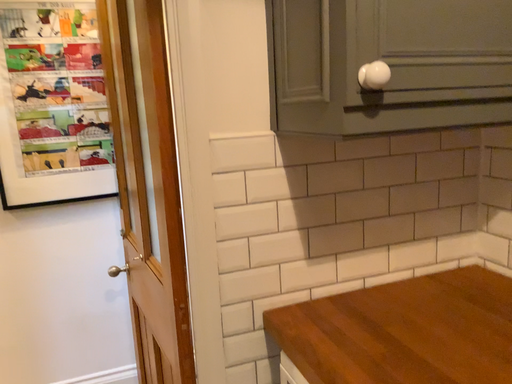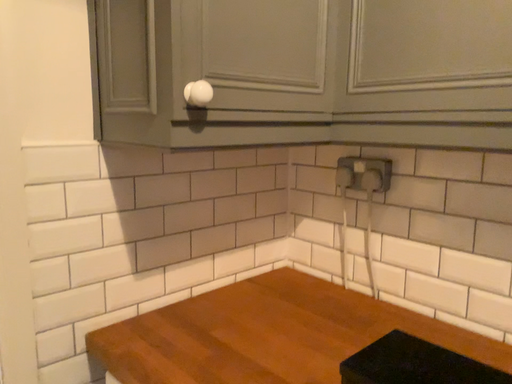
Question: How did the camera likely rotate when shooting the video?

Choices:
 (A) rotated right
 (B) rotated left

Answer: (A)